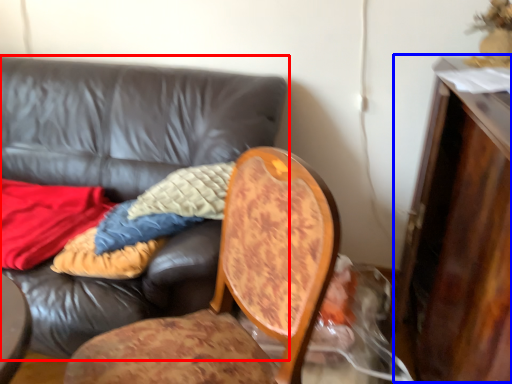
Question: Among these objects, which one is nearest to the camera, studio couch (highlighted by a red box) or dresser (highlighted by a blue box)?

Choices:
 (A) studio couch
 (B) dresser

Answer: (B)